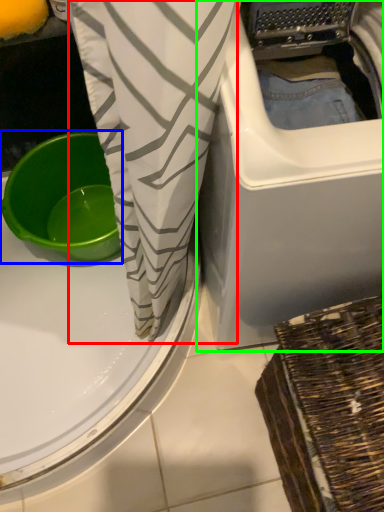
Question: Estimate the real-world distances between objects in this image. Which object is closer to clothing (highlighted by a red box), basin (highlighted by a blue box) or washing machine (highlighted by a green box)?

Choices:
 (A) basin
 (B) washing machine

Answer: (B)